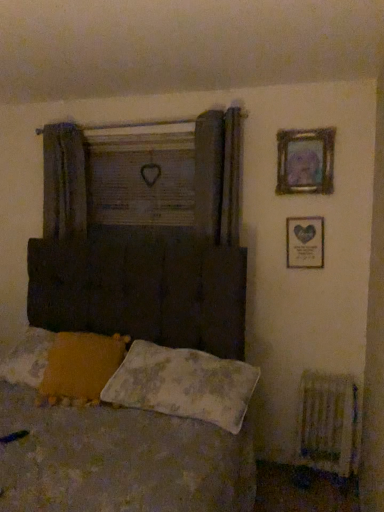
Question: Considering the relative sizes of metallic silver picture frame at upper right, the first picture frame from the bottom, and metallic gold picture frame at upper right, the first picture frame when ordered from top to bottom, in the image provided, is metallic silver picture frame at upper right, the first picture frame from the bottom, smaller than metallic gold picture frame at upper right, the first picture frame when ordered from top to bottom,?

Choices:
 (A) yes
 (B) no

Answer: (A)

Question: Considering the relative sizes of metallic silver picture frame at upper right, the first picture frame from the bottom, and metallic gold picture frame at upper right, the first picture frame when ordered from top to bottom, in the image provided, is metallic silver picture frame at upper right, the first picture frame from the bottom, shorter than metallic gold picture frame at upper right, the first picture frame when ordered from top to bottom,?

Choices:
 (A) no
 (B) yes

Answer: (B)

Question: Is metallic silver picture frame at upper right, which is counted as the second picture frame, starting from the top, looking in the opposite direction of metallic gold picture frame at upper right, the second picture frame ordered from the bottom?

Choices:
 (A) yes
 (B) no

Answer: (B)

Question: From the image's perspective, would you say metallic silver picture frame at upper right, the first picture frame from the bottom, is shown under metallic gold picture frame at upper right, the first picture frame when ordered from top to bottom?

Choices:
 (A) yes
 (B) no

Answer: (A)

Question: Is metallic silver picture frame at upper right, the first picture frame from the bottom, wider than metallic gold picture frame at upper right, the second picture frame ordered from the bottom?

Choices:
 (A) no
 (B) yes

Answer: (A)

Question: In terms of width, does textured fabric bed at center look wider or thinner when compared to metallic silver picture frame at upper right, the first picture frame from the bottom?

Choices:
 (A) thin
 (B) wide

Answer: (B)

Question: Do you think textured fabric bed at center is within metallic silver picture frame at upper right, which is counted as the second picture frame, starting from the top, or outside of it?

Choices:
 (A) inside
 (B) outside

Answer: (B)

Question: Considering their positions, is textured fabric bed at center located in front of or behind metallic silver picture frame at upper right, the first picture frame from the bottom?

Choices:
 (A) behind
 (B) front

Answer: (B)

Question: Is textured fabric bed at center to the left or to the right of metallic silver picture frame at upper right, the first picture frame from the bottom, in the image?

Choices:
 (A) left
 (B) right

Answer: (A)

Question: In terms of height, does yellow fabric pillow at lower left, which is the 2th pillow in right-to-left order, look taller or shorter compared to fluffy white pillow at lower center, which is the second pillow from left to right?

Choices:
 (A) tall
 (B) short

Answer: (A)

Question: From the image's perspective, is yellow fabric pillow at lower left, placed as the first pillow when sorted from left to right, above or below fluffy white pillow at lower center, which is the second pillow from left to right?

Choices:
 (A) above
 (B) below

Answer: (A)

Question: Is yellow fabric pillow at lower left, which is the 2th pillow in right-to-left order, in front of or behind fluffy white pillow at lower center, which is the second pillow from left to right, in the image?

Choices:
 (A) front
 (B) behind

Answer: (B)

Question: Looking at the image, does yellow fabric pillow at lower left, placed as the first pillow when sorted from left to right, seem bigger or smaller compared to fluffy white pillow at lower center, placed as the 1th pillow when sorted from right to left?

Choices:
 (A) small
 (B) big

Answer: (A)

Question: Looking at the image, does wooden frame at upper center seem bigger or smaller compared to yellow fabric pillow at lower left, which is the 2th pillow in right-to-left order?

Choices:
 (A) small
 (B) big

Answer: (A)

Question: From the image's perspective, relative to yellow fabric pillow at lower left, which is the 2th pillow in right-to-left order, is wooden frame at upper center above or below?

Choices:
 (A) below
 (B) above

Answer: (B)